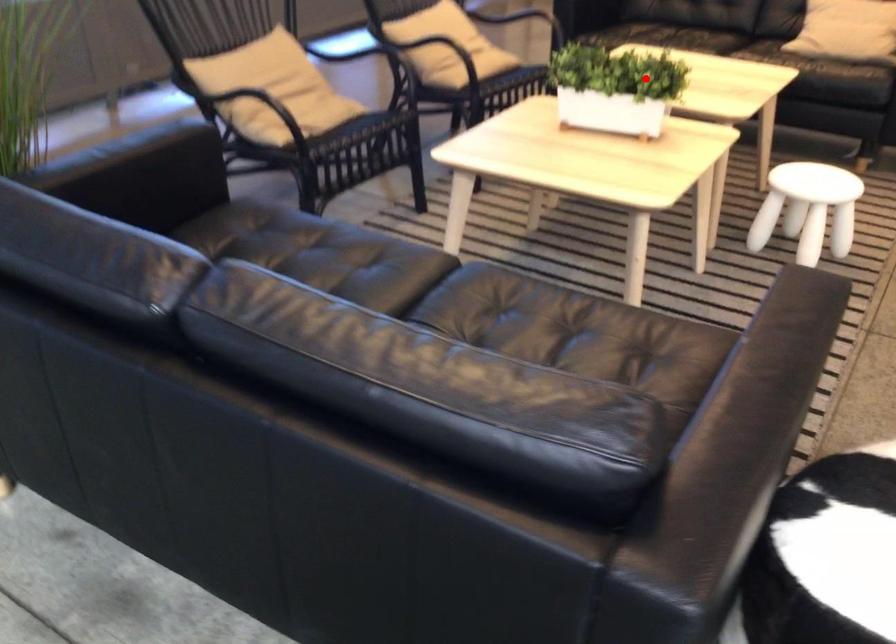
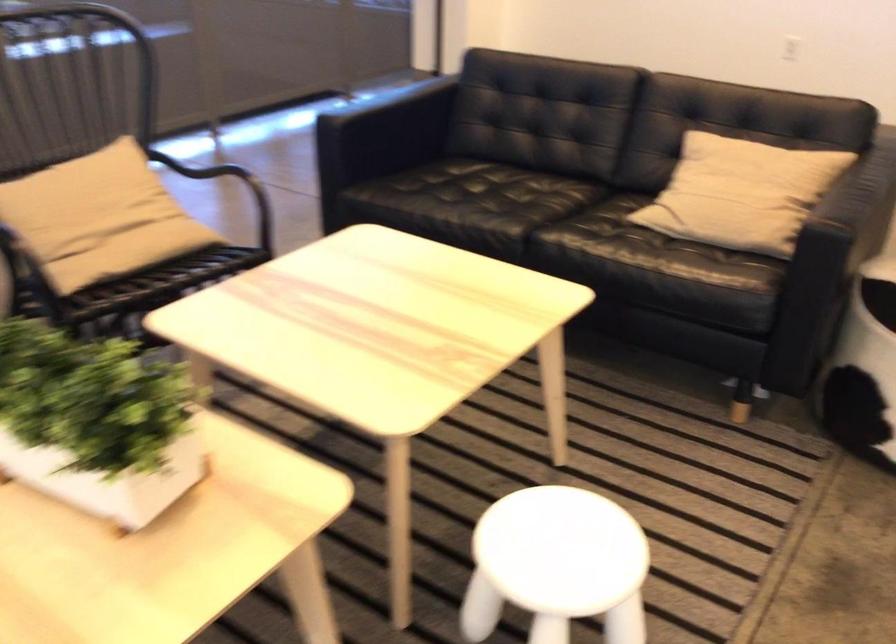
In the second image, find the point that corresponds to the highlighted location in the first image.

(96, 422)